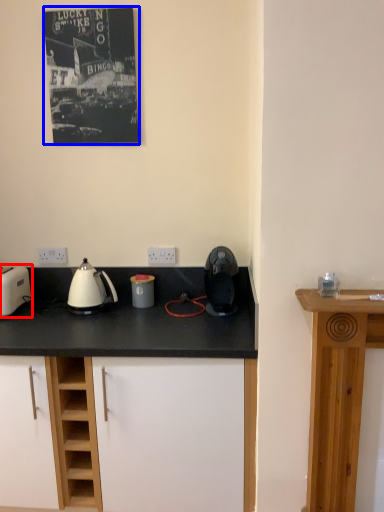
Question: Which point is further to the camera, toaster (highlighted by a red box) or picture frame (highlighted by a blue box)?

Choices:
 (A) toaster
 (B) picture frame

Answer: (B)